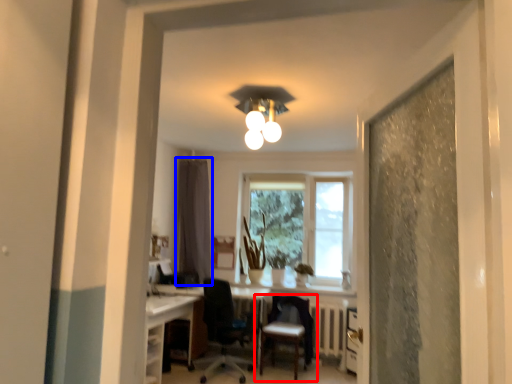
Question: Among these objects, which one is farthest to the camera, chair (highlighted by a red box) or curtain (highlighted by a blue box)?

Choices:
 (A) chair
 (B) curtain

Answer: (B)